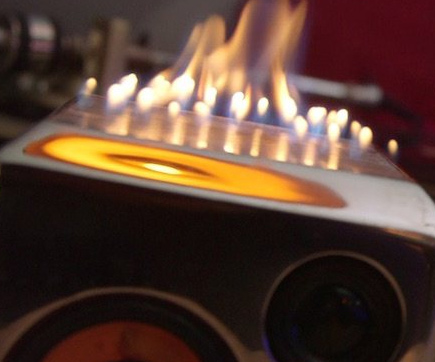
You are a GUI agent. You are given a task and a screenshot of the screen. Output one action in this format:
    pyautogui.click(x=<x>, y=<y>)
    Task: Click on the brown section of table
    
    Given the screenshot: What is the action you would take?
    pyautogui.click(x=374, y=162)